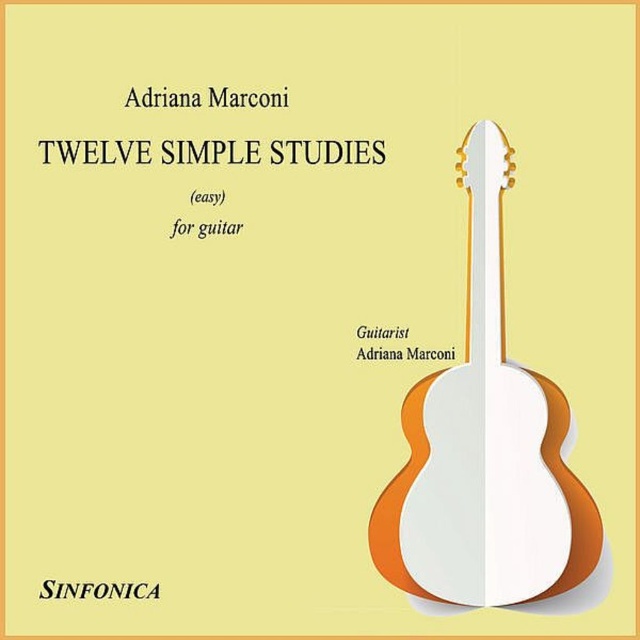
Which is above, white glossy guitar at center or white paper guitar at right?

white paper guitar at right is higher up.

Is point (472, 532) less distant than point (410, 348)?

Yes, it is.

Where is `white glossy guitar at center`? Image resolution: width=640 pixels, height=640 pixels. white glossy guitar at center is located at coordinates (484, 449).

Is black text at upper center to the left of black paper at upper center from the viewer's perspective?

Correct, you'll find black text at upper center to the left of black paper at upper center.

Who is shorter, black text at upper center or black paper at upper center?

black paper at upper center is shorter.

Who is more distant from viewer, (65, 595) or (371, 337)?

The point (371, 337) is more distant.

Locate an element on the screen. The width and height of the screenshot is (640, 640). black text at upper center is located at coordinates (97, 589).

Is black text at upper center smaller than white paper guitar at right?

No, black text at upper center is not smaller than white paper guitar at right.

Does black text at upper center have a greater height compared to white paper guitar at right?

Yes.

Is point (93, 592) closer to camera compared to point (384, 353)?

Yes, point (93, 592) is closer to viewer.

At what (x,y) coordinates should I click in order to perform the action: click on black text at upper center. Please return your answer as a coordinate pair (x, y). The height and width of the screenshot is (640, 640). Looking at the image, I should click on (97, 589).